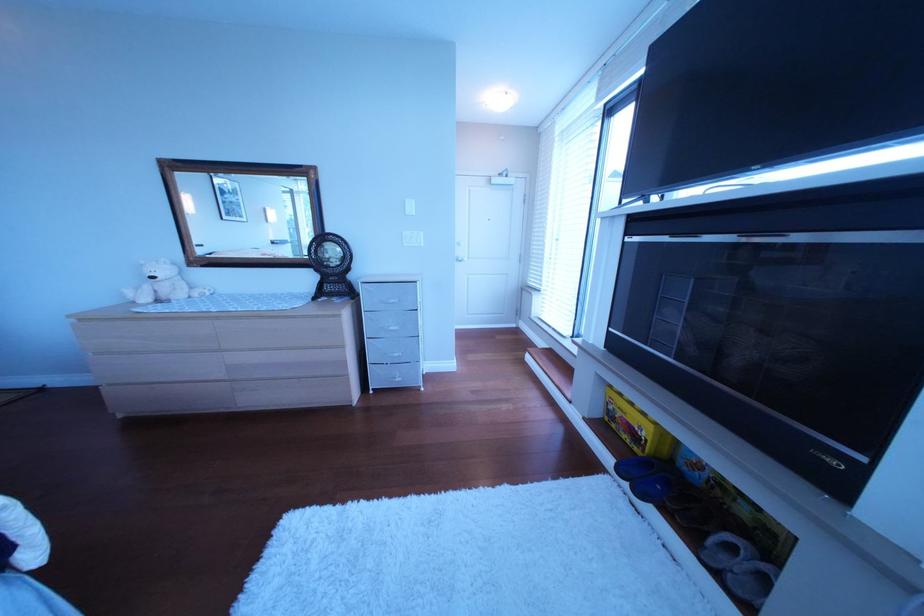
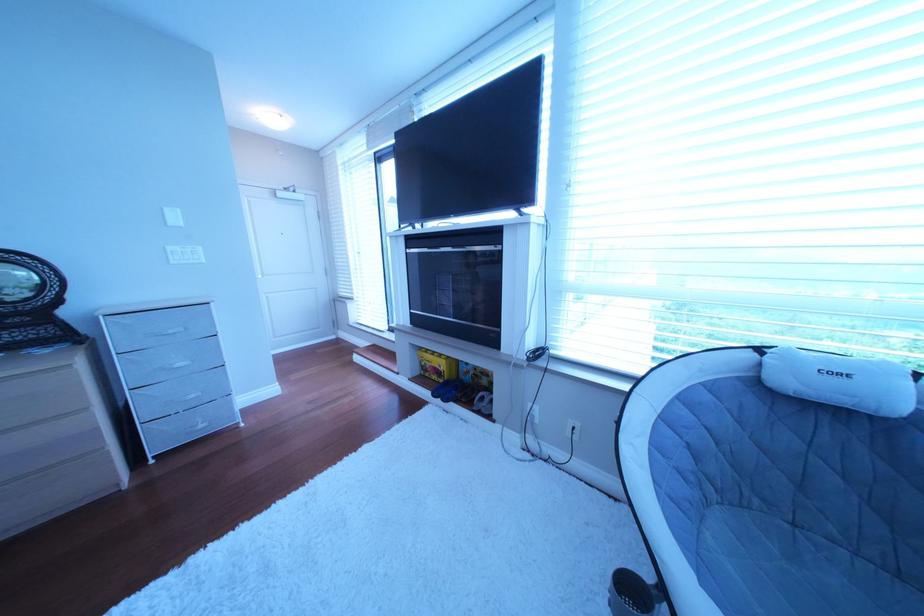
Find the pixel in the second image that matches the point at 640,439 in the first image.

(450, 379)